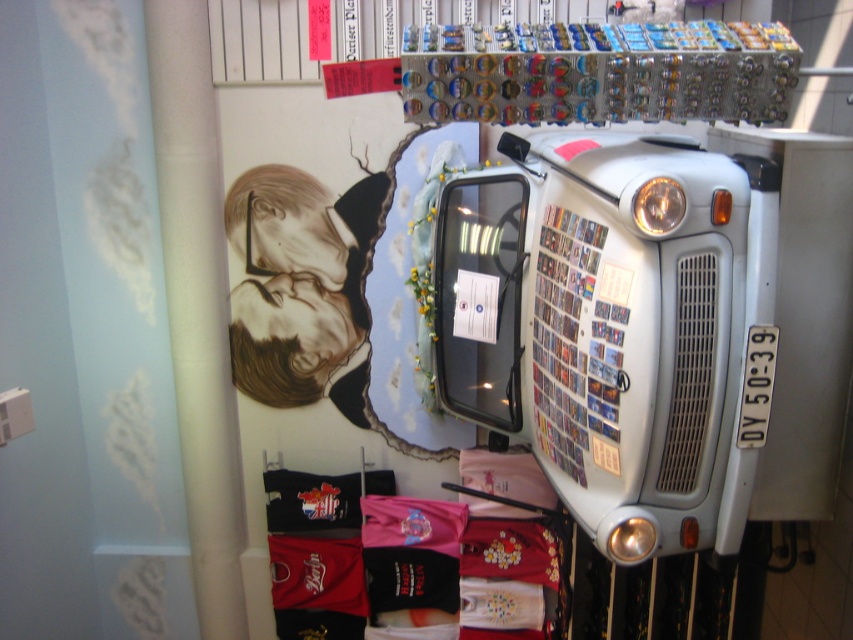
Question: Which point is farther to the camera?

Choices:
 (A) light gray metallic truck at center
 (B) white matte pillar at left

Answer: (B)

Question: Among these points, which one is nearest to the camera?

Choices:
 (A) (228, 481)
 (B) (815, 492)

Answer: (B)

Question: Does light gray metallic truck at center lie behind white matte pillar at left?

Choices:
 (A) yes
 (B) no

Answer: (B)

Question: Is light gray metallic truck at center positioned in front of white matte pillar at left?

Choices:
 (A) no
 (B) yes

Answer: (B)

Question: Among these objects, which one is farthest from the camera?

Choices:
 (A) light gray metallic truck at center
 (B) white matte pillar at left

Answer: (B)

Question: Can you confirm if light gray metallic truck at center is thinner than white matte pillar at left?

Choices:
 (A) no
 (B) yes

Answer: (A)